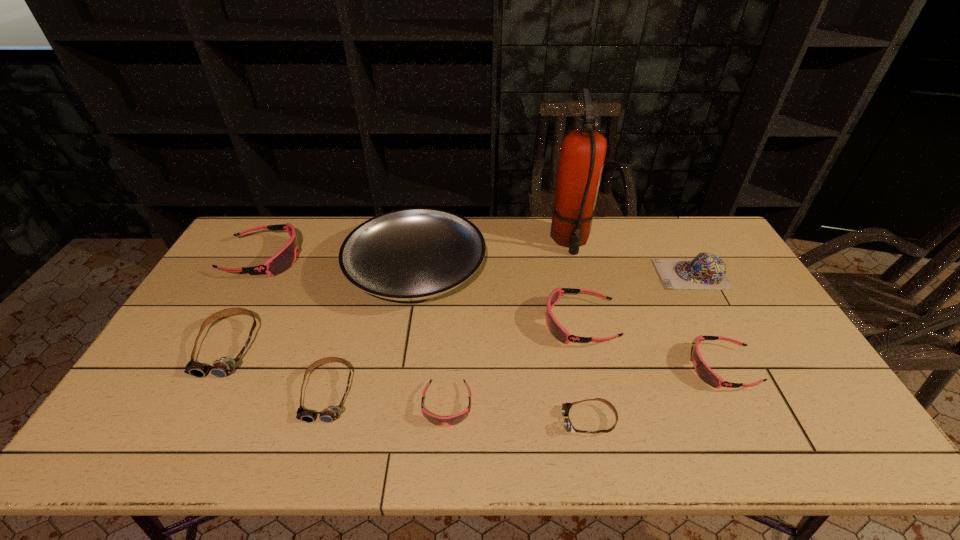
This screenshot has width=960, height=540. I want to click on the second smallest brown goggles, so click(331, 413).

The image size is (960, 540). I want to click on the third pink goggles from right to left, so click(453, 420).

At what (x,y) coordinates should I click in order to perform the action: click on the smallest pink goggles. Please return your answer as a coordinate pair (x, y). The height and width of the screenshot is (540, 960). Looking at the image, I should click on (453, 420).

Locate an element on the screen. Image resolution: width=960 pixels, height=540 pixels. the rightmost brown goggles is located at coordinates (568, 426).

Identify the location of vacant region located 0.270m on the nozzle of the tallest object. (589, 320).

Where is `free space located on the front of the bedpan`? The width and height of the screenshot is (960, 540). free space located on the front of the bedpan is located at coordinates (389, 435).

You are a GUI agent. You are given a task and a screenshot of the screen. Output one action in this format:
    pyautogui.click(x=<x>, y=<y>)
    Task: Click on the vacant space located on the front-facing side of the leftmost pink goggles
    The width and height of the screenshot is (960, 540).
    Given the screenshot: What is the action you would take?
    pyautogui.click(x=365, y=258)

Identify the location of vacant region located on the front, side, and top of the cap. This screenshot has height=540, width=960. (582, 274).

Locate an element on the screen. This screenshot has width=960, height=540. vacant region located 0.110m on the front, side, and top of the cap is located at coordinates (625, 274).

Locate an element on the screen. Image resolution: width=960 pixels, height=540 pixels. free space located 0.070m on the front, side, and top of the cap is located at coordinates (636, 274).